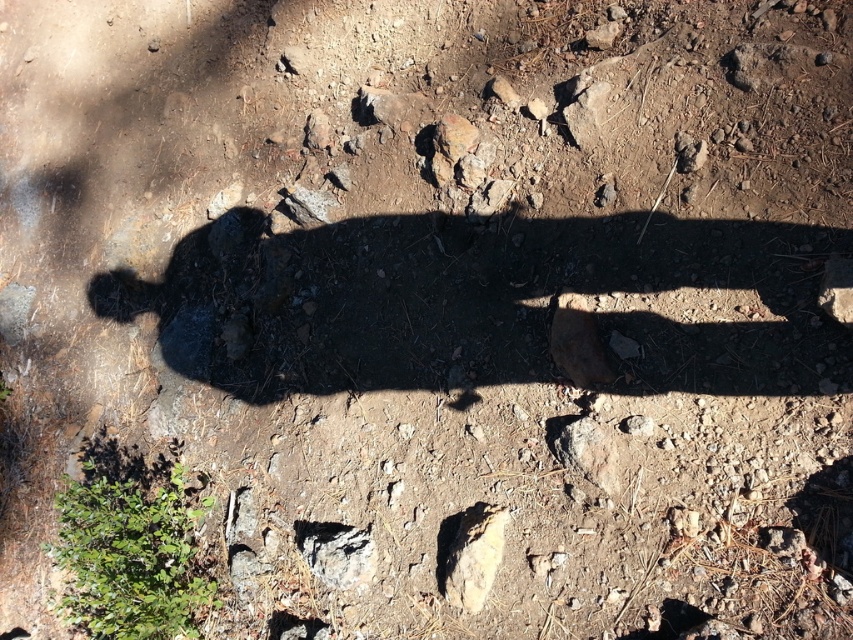
Where is `smooth beige rock at lower center`? The image size is (853, 640). smooth beige rock at lower center is located at coordinates (474, 556).

Does smooth beige rock at lower center have a smaller size compared to gray rough rock at center?

Indeed, smooth beige rock at lower center has a smaller size compared to gray rough rock at center.

At what (x,y) coordinates should I click in order to perform the action: click on smooth beige rock at lower center. Please return your answer as a coordinate pair (x, y). This screenshot has height=640, width=853. Looking at the image, I should click on (474, 556).